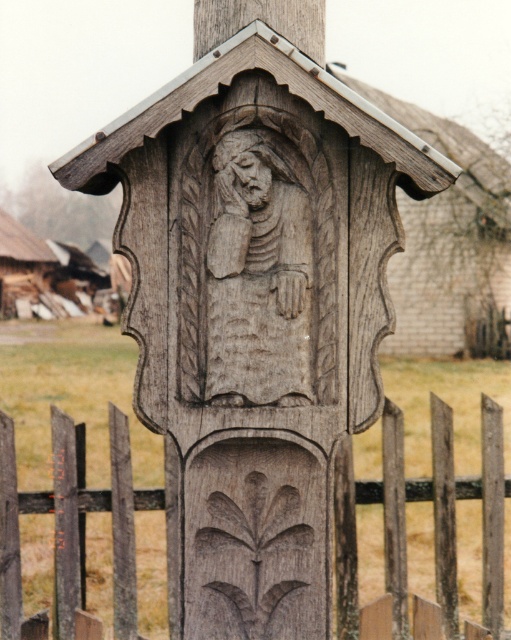
Question: Observing the image, what is the correct spatial positioning of wooden carved figure at center in reference to carved wood face at center?

Choices:
 (A) above
 (B) below

Answer: (B)

Question: Which point is closer to the camera?

Choices:
 (A) (220, 241)
 (B) (244, 195)

Answer: (A)

Question: Which of the following is the closest to the observer?

Choices:
 (A) (60, 520)
 (B) (246, 192)

Answer: (B)

Question: Is weathered wood fence at lower center further to the viewer compared to wooden carved figure at center?

Choices:
 (A) yes
 (B) no

Answer: (A)

Question: Among these objects, which one is nearest to the camera?

Choices:
 (A) weathered wood fence at lower center
 (B) carved wood face at center

Answer: (B)

Question: Is weathered wood fence at lower center positioned in front of carved wood face at center?

Choices:
 (A) yes
 (B) no

Answer: (B)